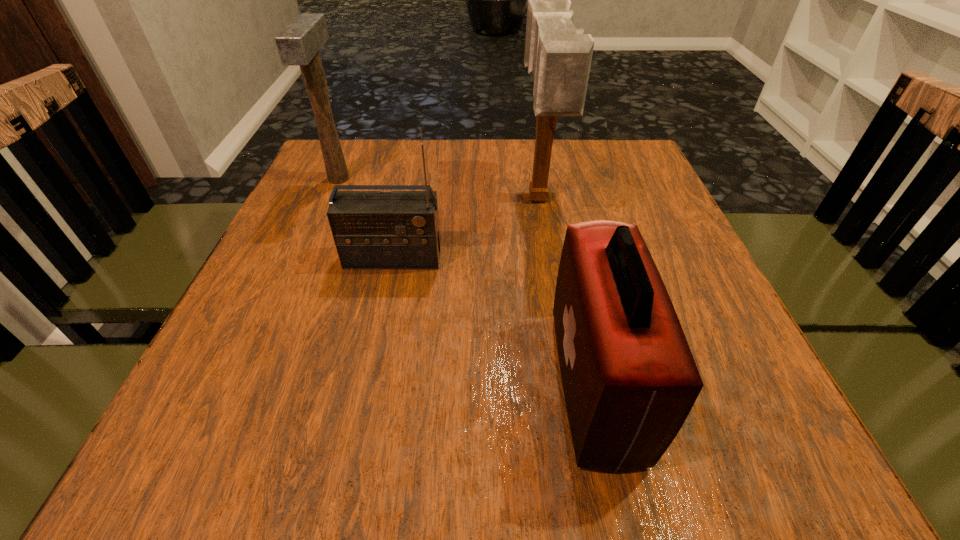
In the image, there is a desktop. What are the coordinates of `free space at the near right corner` in the screenshot? It's located at (810, 471).

This screenshot has height=540, width=960. What are the coordinates of `vacant space that is in between the left mallet and the right mallet` in the screenshot? It's located at (439, 190).

The image size is (960, 540). I want to click on unoccupied area between the first aid kit and the radio receiver, so click(x=493, y=321).

I want to click on empty space between the nearest object and the third object from right to left, so click(x=493, y=321).

This screenshot has width=960, height=540. I want to click on unoccupied position between the right mallet and the second nearest object, so click(x=466, y=230).

Identify the location of vacant space that is in between the first aid kit and the leftmost object. (467, 281).

I want to click on vacant area that lies between the nearest object and the second nearest object, so click(493, 321).

You are a GUI agent. You are given a task and a screenshot of the screen. Output one action in this format:
    pyautogui.click(x=<x>, y=<y>)
    Task: Click on the vacant space that is in between the right mallet and the third object from right to left
    The image size is (960, 540).
    Given the screenshot: What is the action you would take?
    pyautogui.click(x=466, y=230)

Select which object is the second closest to the nearest object. Please provide its 2D coordinates. Your answer should be formatted as a tuple, i.e. [(x, y)], where the tuple contains the x and y coordinates of a point satisfying the conditions above.

[(371, 229)]

Identify the location of object that can be found as the closest to the left mallet. (371, 229).